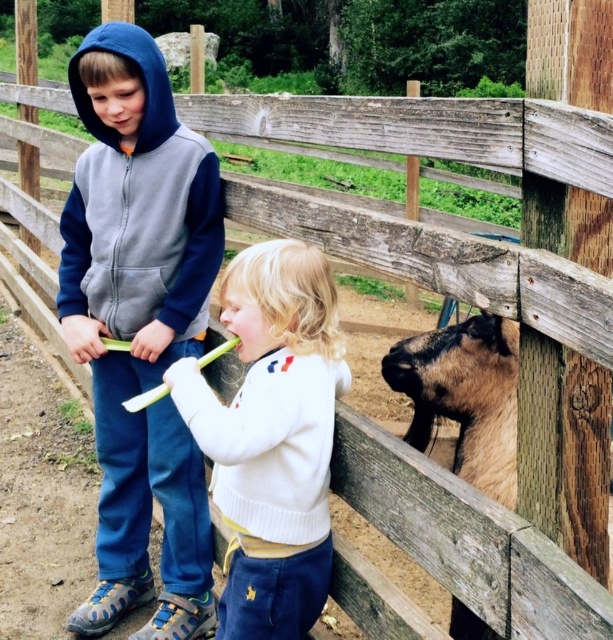
Is point (242, 577) positioned behind point (500, 392)?

No, it is not.

Who is positioned more to the left, white soft sweater at center or brown fuzzy goat at right?

white soft sweater at center

The height and width of the screenshot is (640, 613). Find the location of `white soft sweater at center`. white soft sweater at center is located at coordinates (272, 436).

Which is more to the right, navy blue fleece hoodie at center or brown fuzzy goat at right?

brown fuzzy goat at right is more to the right.

Does navy blue fleece hoodie at center lie behind brown fuzzy goat at right?

No, it is in front of brown fuzzy goat at right.

Is point (153, 317) positioned behind point (409, 396)?

No.

Where is `navy blue fleece hoodie at center`? This screenshot has height=640, width=613. navy blue fleece hoodie at center is located at coordinates (140, 324).

Which is more to the left, navy blue fleece hoodie at center or white soft sweater at center?

navy blue fleece hoodie at center is more to the left.

Is point (101, 36) closer to camera compared to point (275, 269)?

No, it is behind (275, 269).

This screenshot has height=640, width=613. In order to click on navy blue fleece hoodie at center in this screenshot , I will do `click(140, 324)`.